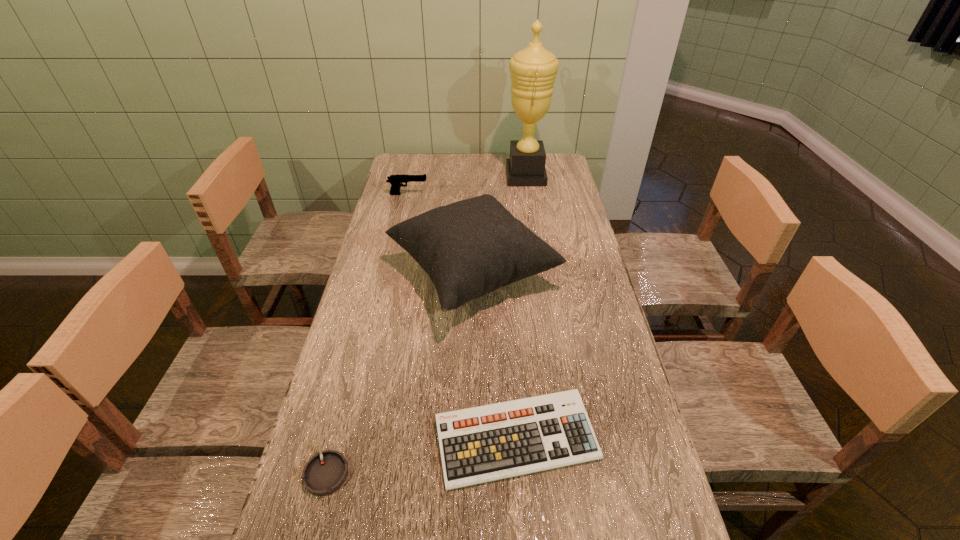
This screenshot has width=960, height=540. Find the location of `blank area located at the front of the trophy cup with handles`. blank area located at the front of the trophy cup with handles is located at coordinates (483, 176).

Locate an element on the screen. This screenshot has width=960, height=540. vacant space located on the front of the second tallest object is located at coordinates (470, 377).

The height and width of the screenshot is (540, 960). In order to click on vacant space located on the front-facing side of the pistol in this screenshot , I will do `click(478, 194)`.

This screenshot has height=540, width=960. I want to click on free space located on the left of the computer keyboard, so click(345, 439).

Locate an element on the screen. vacant area situated 0.120m on the right of the shortest object is located at coordinates (406, 472).

The width and height of the screenshot is (960, 540). I want to click on object that is at the far edge, so click(533, 70).

Locate an element on the screen. Image resolution: width=960 pixels, height=540 pixels. cushion at the left edge is located at coordinates (471, 247).

Locate an element on the screen. This screenshot has height=540, width=960. pistol at the left edge is located at coordinates (396, 181).

The image size is (960, 540). Find the location of `ashtray situated at the left edge`. ashtray situated at the left edge is located at coordinates 325,472.

Identify the location of trophy cup that is at the right edge. The width and height of the screenshot is (960, 540). (533, 70).